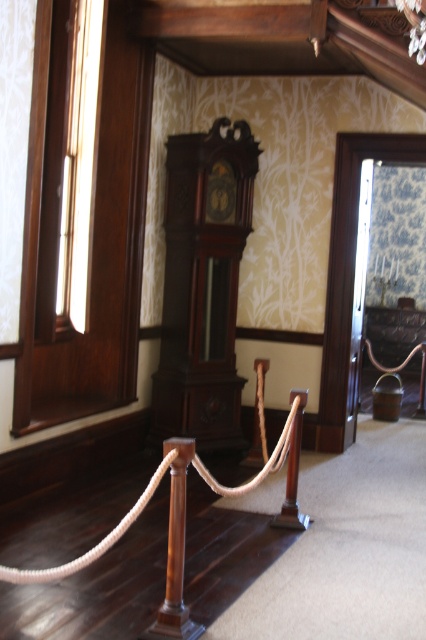
Question: Does dark wood grandfather clock at center appear over brown rope at center?

Choices:
 (A) no
 (B) yes

Answer: (B)

Question: Does dark wood grandfather clock at center have a smaller size compared to brown rope at center?

Choices:
 (A) yes
 (B) no

Answer: (A)

Question: Can you confirm if dark wood grandfather clock at center is positioned above brown rope at center?

Choices:
 (A) no
 (B) yes

Answer: (B)

Question: Which point is closer to the camera?

Choices:
 (A) (157, 477)
 (B) (244, 152)

Answer: (A)

Question: Among these objects, which one is nearest to the camera?

Choices:
 (A) brown rope at center
 (B) dark wood grandfather clock at center

Answer: (A)